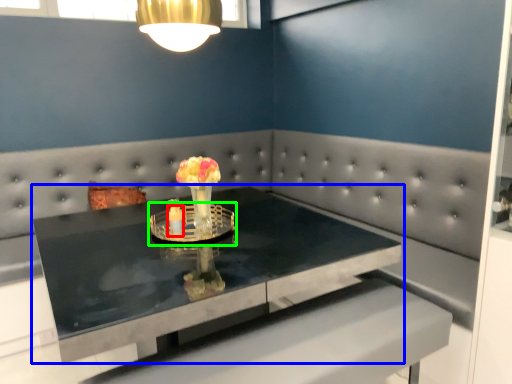
Question: Which object is positioned closest to candle holder (highlighted by a red box)? Select from table (highlighted by a blue box) and candle holder (highlighted by a green box).

Choices:
 (A) table
 (B) candle holder

Answer: (B)